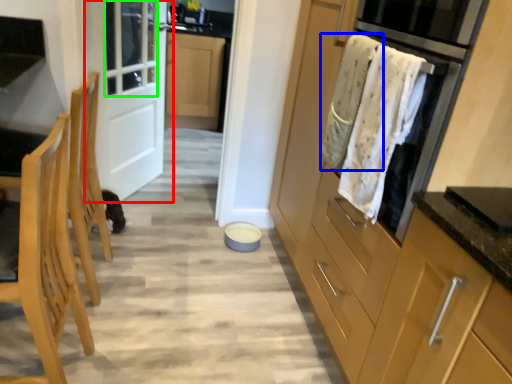
Question: Based on their relative distances, which object is nearer to door (highlighted by a red box)? Choose from laundry (highlighted by a blue box) and window (highlighted by a green box).

Choices:
 (A) laundry
 (B) window

Answer: (B)